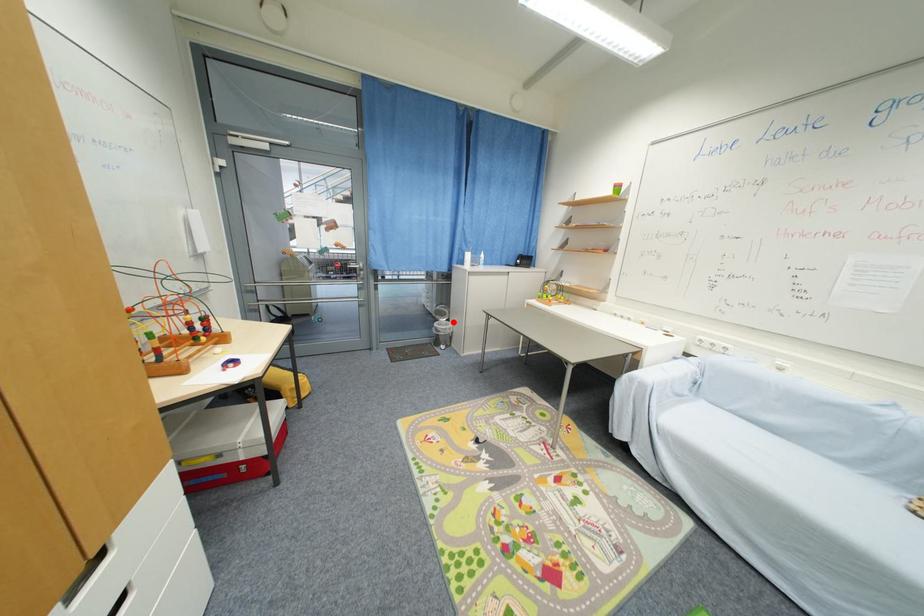
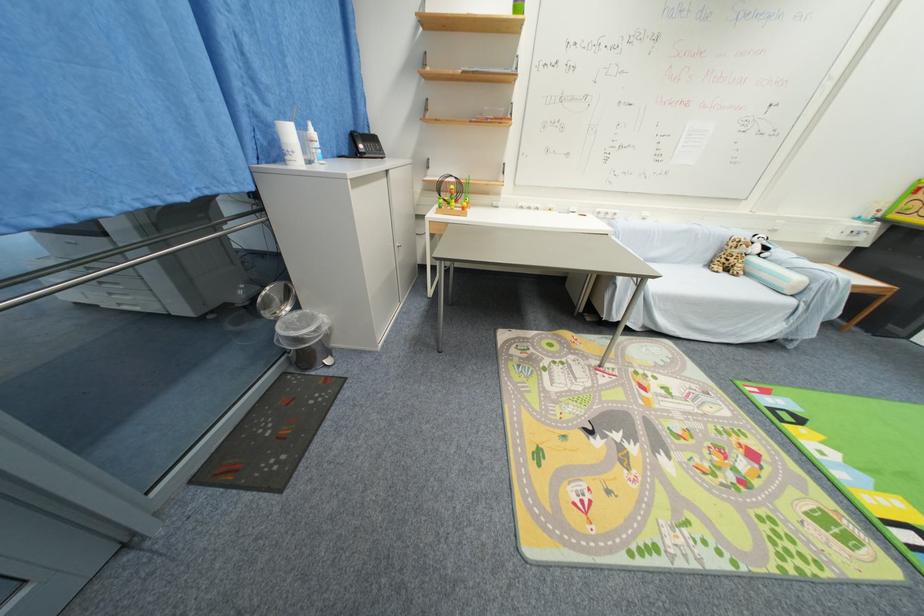
Where in the second image is the point corresponding to the highlighted location from the first image?

(301, 309)